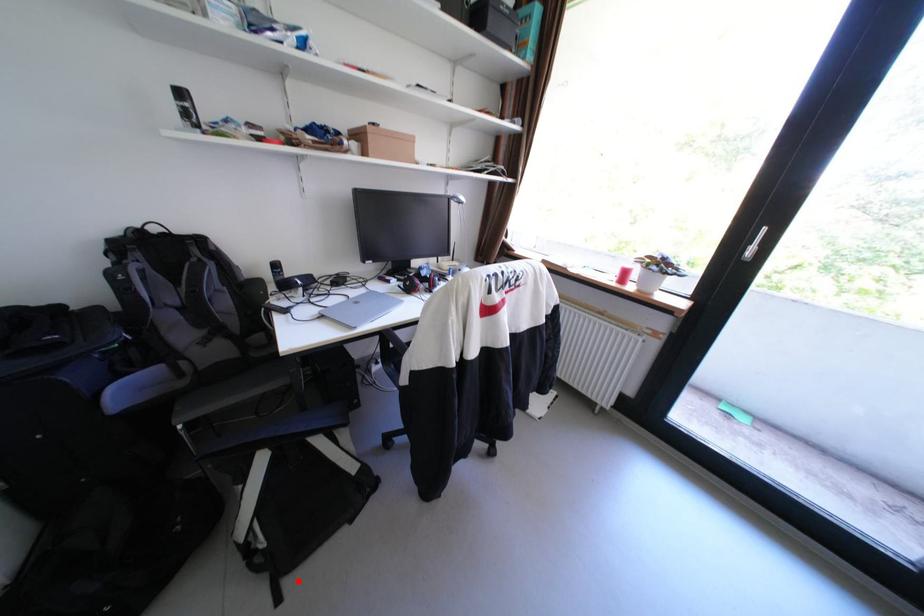
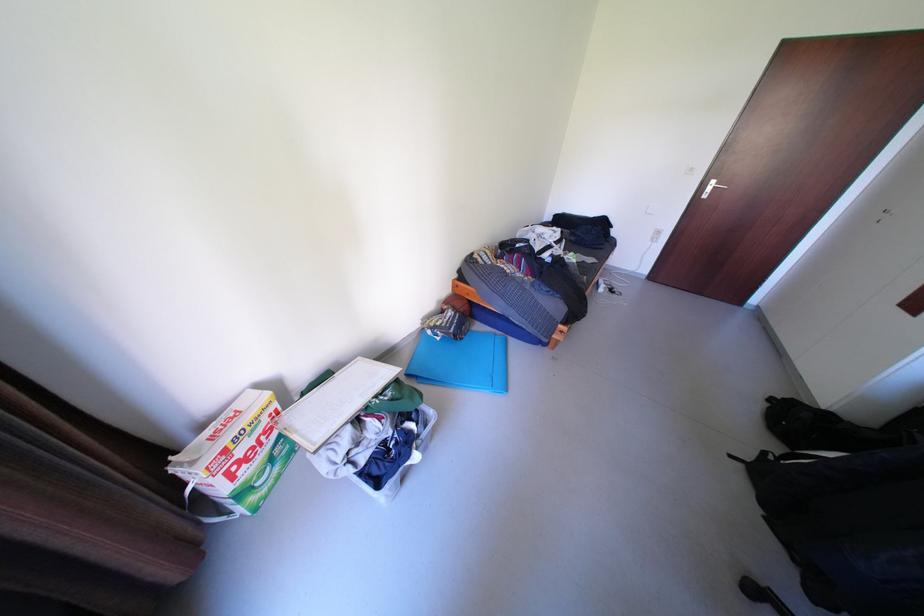
Question: I am providing you with two images of the same scene from different viewpoints. Given a red point in image1, look at the same physical point in image2. Is it:

Choices:
 (A) Closer to the viewpoint
 (B) Farther from the viewpoint

Answer: (B)